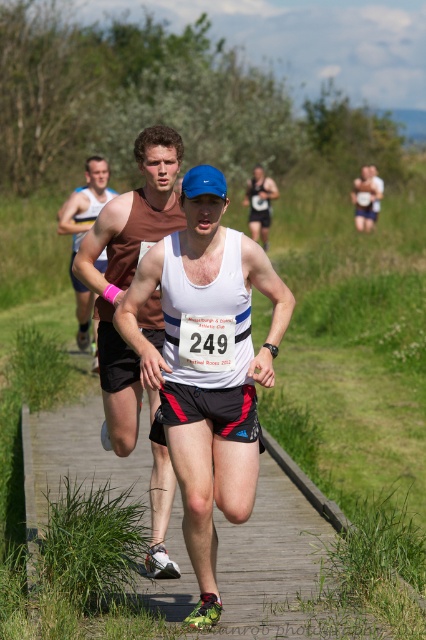
Question: Among these objects, which one is nearest to the camera?

Choices:
 (A) white paper number at center
 (B) white matte tank top at center
 (C) wooden boardwalk at center

Answer: (B)

Question: Which of the following is the closest to the observer?

Choices:
 (A) wooden boardwalk at center
 (B) white matte tank top at center

Answer: (B)

Question: Can you confirm if wooden boardwalk at center is wider than matte black tank top at center?

Choices:
 (A) yes
 (B) no

Answer: (A)

Question: Can you confirm if matte brown tank top at center is wider than matte brown tank top at upper left?

Choices:
 (A) no
 (B) yes

Answer: (A)

Question: Can you confirm if matte brown tank top at center is positioned above matte brown tank top at upper left?

Choices:
 (A) no
 (B) yes

Answer: (A)

Question: Which object appears farthest from the camera in this image?

Choices:
 (A) white paper number at center
 (B) white matte tank top at center
 (C) matte brown tank top at upper left

Answer: (C)